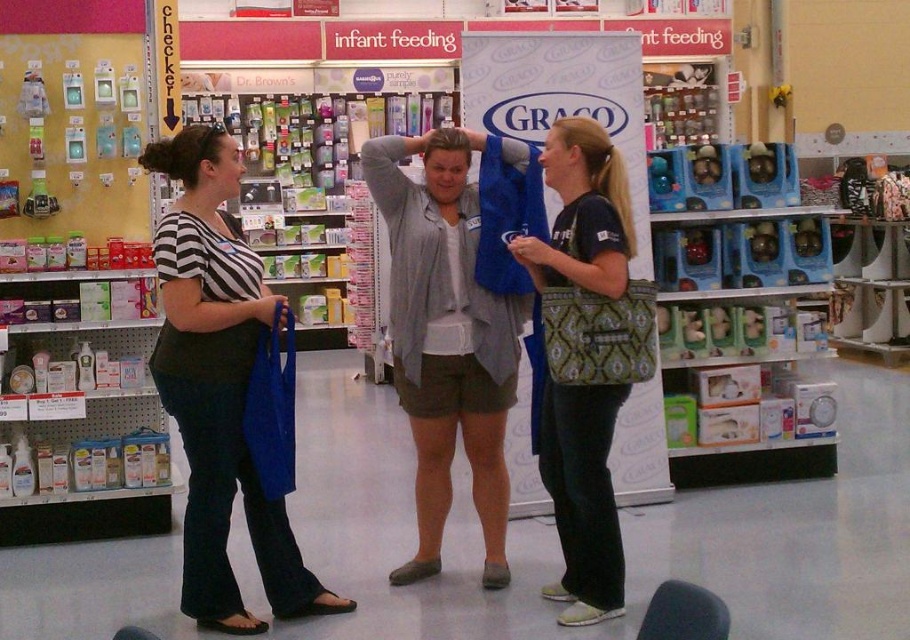
Between matte black shirt at left and matte green bag at center, which one is positioned lower?

Positioned lower is matte black shirt at left.

Does point (240, 362) lie behind point (588, 540)?

No, (240, 362) is in front of (588, 540).

Where is `matte black shirt at left`? matte black shirt at left is located at coordinates (219, 387).